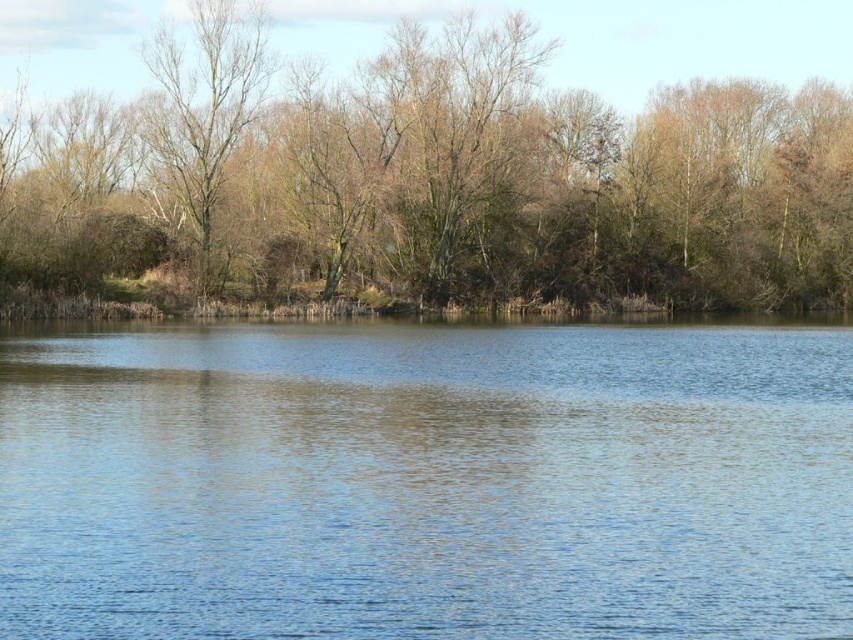
Is blue water at center to the right of bare branches at left from the viewer's perspective?

Yes, blue water at center is to the right of bare branches at left.

This screenshot has height=640, width=853. What do you see at coordinates (426, 483) in the screenshot?
I see `blue water at center` at bounding box center [426, 483].

Image resolution: width=853 pixels, height=640 pixels. Identify the location of blue water at center. point(426,483).

Is point (606, 492) farther from viewer compared to point (596, 168)?

No, it is not.

Is blue water at center bigger than brown leafless trees at upper center?

Actually, blue water at center might be smaller than brown leafless trees at upper center.

Who is more distant from viewer, (486, 435) or (302, 269)?

The point (302, 269) is more distant.

Where is `blue water at center`? The image size is (853, 640). blue water at center is located at coordinates (426, 483).

Which is in front, point (479, 140) or point (195, 80)?

Positioned in front is point (195, 80).

Does brown leafless trees at upper center appear on the left side of bare branches at left?

In fact, brown leafless trees at upper center is to the right of bare branches at left.

At what (x,y) coordinates should I click in order to perform the action: click on brown leafless trees at upper center. Please return your answer as a coordinate pair (x, y). This screenshot has height=640, width=853. Looking at the image, I should click on [428, 179].